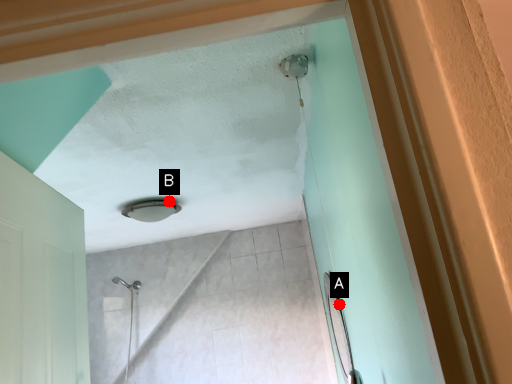
Question: Two points are circled on the image, labeled by A and B beside each circle. Which of the following is the closest to the observer?

Choices:
 (A) A is closer
 (B) B is closer

Answer: (A)